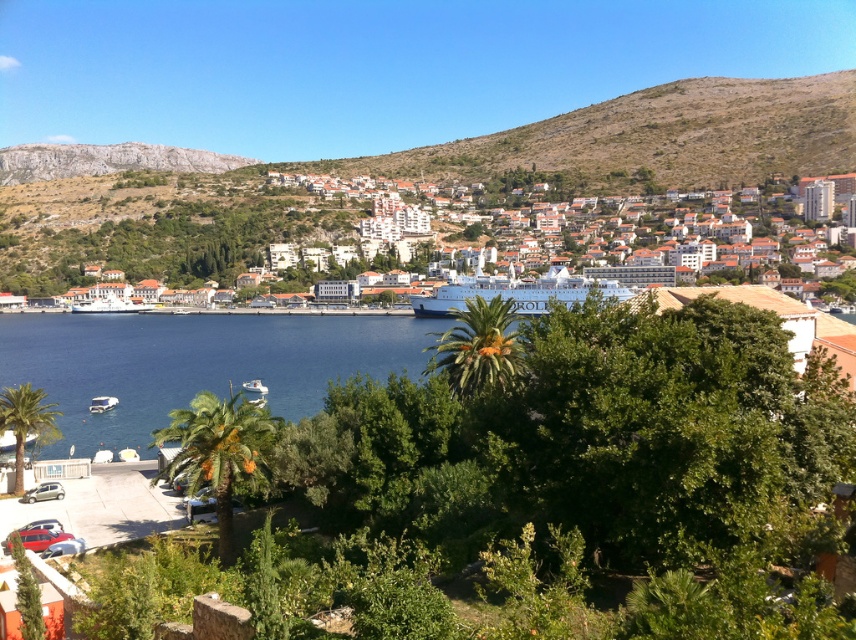
You are standing at the point with coordinates point (x=348, y=177) and want to walk to the cruise ship ORO docked in the harbor. There is an obstacle at point (x=476, y=204). Will you be able to see the obstacle from your current position?

The point (x=476, y=204) is in front of point (x=348, y=177), so yes, you can see the obstacle at point (x=476, y=204) from your current position at point (x=348, y=177) because it is located in front of you.

You are a tourist standing in the coastal town and want to take a photo of the white textured buildings at center and the brown rocky hillside at center. Which one will appear closer to you in the photo?

The white textured buildings at center will appear closer to you in the photo because they are positioned in front of the brown rocky hillside at center.